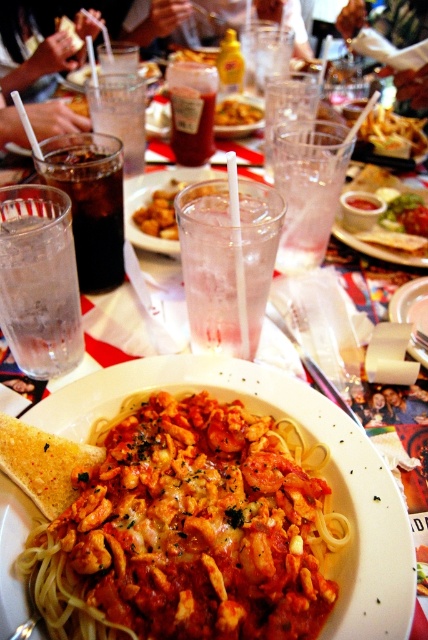
You are a customer at this restaurant and want to place your napkin on the table. The napkin is 0.2 meters wide. Can you place it at the point with coordinates point (192, 125) without overlapping any objects?

The point 0.197, 0449 is on a translucent glass at center, so placing the napkin there would overlap with the glass. Choose another spot on the table.

You are sitting at the table and want to reach for both items located at point (74, 220) and point (222, 108). Which point will you reach first?

Point (74, 220) is in front of point (222, 108), so you will reach it first.